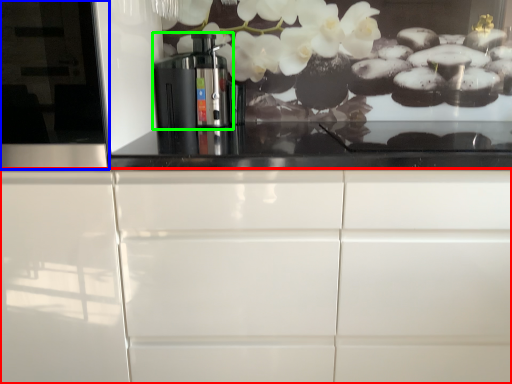
Question: Which object is the closest to the cabinetry (highlighted by a red box)? Choose among these: glass door (highlighted by a blue box) or home appliance (highlighted by a green box).

Choices:
 (A) glass door
 (B) home appliance

Answer: (A)